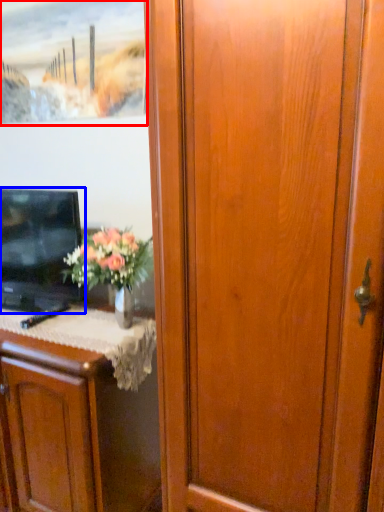
Question: Among these objects, which one is nearest to the camera, picture frame (highlighted by a red box) or television (highlighted by a blue box)?

Choices:
 (A) picture frame
 (B) television

Answer: (B)